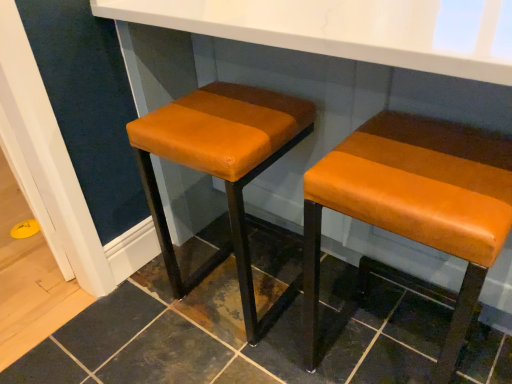
Question: From the image's perspective, relative to orange leather stool at right, the 2th stool from the left, is orange leather stool at center, which appears as the first stool when viewed from the left, above or below?

Choices:
 (A) below
 (B) above

Answer: (B)

Question: From a real-world perspective, is orange leather stool at center, which appears as the first stool when viewed from the left, physically located above or below orange leather stool at right, the 2th stool from the left?

Choices:
 (A) below
 (B) above

Answer: (A)

Question: In the image, is orange leather stool at center, which appears as the first stool when viewed from the left, on the left side or the right side of orange leather stool at right, the 1th stool in the right-to-left sequence?

Choices:
 (A) right
 (B) left

Answer: (B)

Question: In terms of height, does orange leather stool at right, the 1th stool in the right-to-left sequence, look taller or shorter compared to orange leather stool at center, which appears as the first stool when viewed from the left?

Choices:
 (A) tall
 (B) short

Answer: (B)

Question: Would you say orange leather stool at right, the 1th stool in the right-to-left sequence, is to the left or to the right of orange leather stool at center, which appears as the first stool when viewed from the left, in the picture?

Choices:
 (A) right
 (B) left

Answer: (A)

Question: From a real-world perspective, is orange leather stool at right, the 2th stool from the left, physically located above or below orange leather stool at center, the 2th stool from the right?

Choices:
 (A) above
 (B) below

Answer: (A)

Question: In terms of width, does orange leather stool at right, the 2th stool from the left, look wider or thinner when compared to orange leather stool at center, which appears as the first stool when viewed from the left?

Choices:
 (A) thin
 (B) wide

Answer: (B)